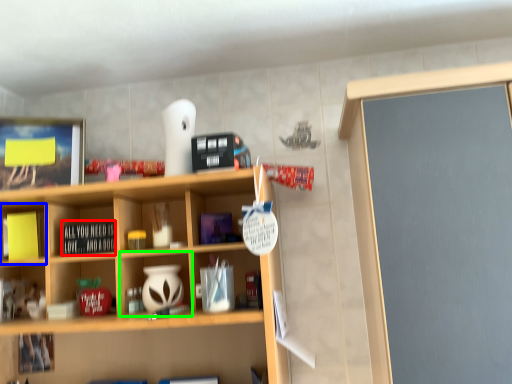
Question: Estimate the real-world distances between objects in this image. Which object is closer to book (highlighted by a red box), cabinet (highlighted by a blue box) or cabinet (highlighted by a green box)?

Choices:
 (A) cabinet
 (B) cabinet

Answer: (B)